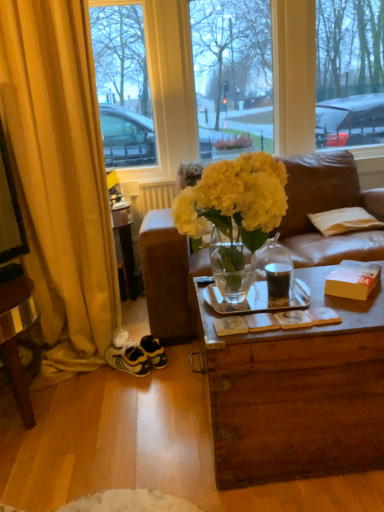
Question: Is white matte radiator at upper center smaller than yellow fabric curtain at left?

Choices:
 (A) no
 (B) yes

Answer: (B)

Question: Is the position of white matte radiator at upper center more distant than that of yellow fabric curtain at left?

Choices:
 (A) no
 (B) yes

Answer: (B)

Question: From the image's perspective, is white matte radiator at upper center located above yellow fabric curtain at left?

Choices:
 (A) no
 (B) yes

Answer: (B)

Question: Can you confirm if white matte radiator at upper center is bigger than yellow fabric curtain at left?

Choices:
 (A) yes
 (B) no

Answer: (B)

Question: Is there a large distance between white matte radiator at upper center and yellow fabric curtain at left?

Choices:
 (A) no
 (B) yes

Answer: (A)

Question: In terms of height, does yellow suede sneakers at lower left look taller or shorter compared to yellow fabric curtain at left?

Choices:
 (A) short
 (B) tall

Answer: (A)

Question: From the image's perspective, relative to yellow fabric curtain at left, is yellow suede sneakers at lower left above or below?

Choices:
 (A) above
 (B) below

Answer: (B)

Question: From a real-world perspective, is yellow suede sneakers at lower left physically located above or below yellow fabric curtain at left?

Choices:
 (A) below
 (B) above

Answer: (A)

Question: Is yellow suede sneakers at lower left bigger or smaller than yellow fabric curtain at left?

Choices:
 (A) small
 (B) big

Answer: (A)

Question: Considering the positions of point (119, 355) and point (380, 266), is point (119, 355) closer or farther from the camera than point (380, 266)?

Choices:
 (A) closer
 (B) farther

Answer: (B)

Question: Considering the relative positions of yellow suede sneakers at lower left and orange cardboard box at right in the image provided, is yellow suede sneakers at lower left to the left or to the right of orange cardboard box at right?

Choices:
 (A) right
 (B) left

Answer: (B)

Question: Considering the positions of yellow suede sneakers at lower left and orange cardboard box at right in the image, is yellow suede sneakers at lower left taller or shorter than orange cardboard box at right?

Choices:
 (A) tall
 (B) short

Answer: (A)

Question: Is yellow suede sneakers at lower left inside the boundaries of orange cardboard box at right, or outside?

Choices:
 (A) outside
 (B) inside

Answer: (A)

Question: Considering the positions of white striped fabric pillow at right and translucent leather couch at center in the image, is white striped fabric pillow at right bigger or smaller than translucent leather couch at center?

Choices:
 (A) small
 (B) big

Answer: (A)

Question: Considering the relative positions of white striped fabric pillow at right and translucent leather couch at center in the image provided, is white striped fabric pillow at right to the left or to the right of translucent leather couch at center?

Choices:
 (A) left
 (B) right

Answer: (B)